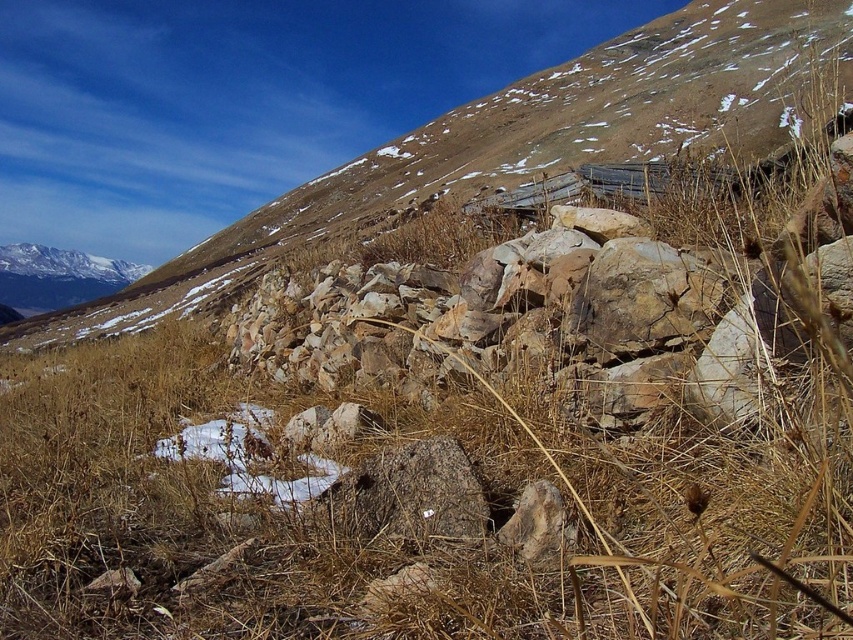
Consider the image. You are a hiker trying to navigate between the dry grass at center and the rocky at center. If your backpack has a 9 feet rope, can you safely cross the gap between them using the rope?

The dry grass at center is 8.84 feet from the rocky at center. Since the rope is 9 feet long, it is slightly longer than the distance between them, so you can safely cross the gap using the rope.

You are a hiker trying to navigate through the dry grass at center and the rocky at center. Which terrain would be easier to walk on?

The rocky at center is taller than the dry grass at center, so walking on the dry grass at center would be easier since it is shorter and less obstructive.